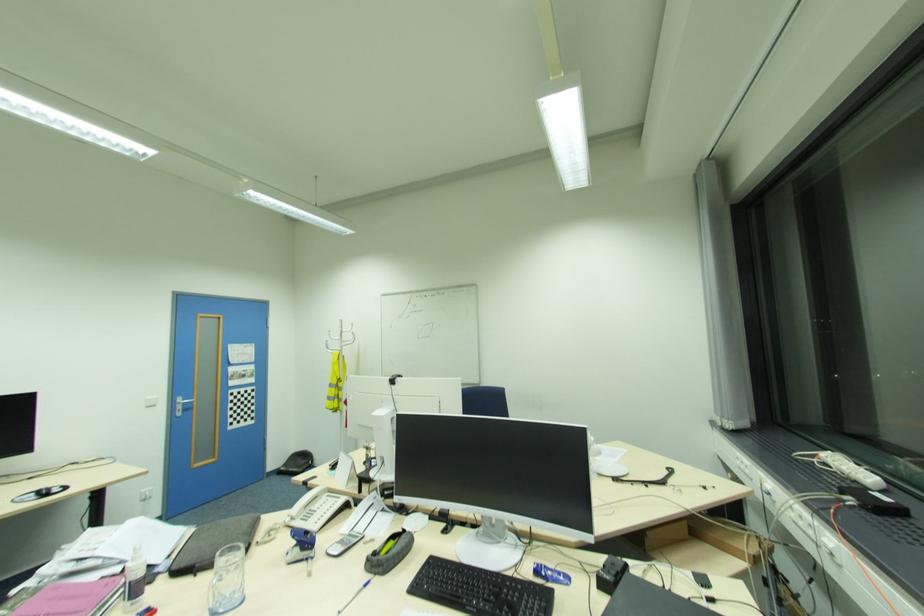
The image size is (924, 616). Identify the location of silver door handle. (183, 400).